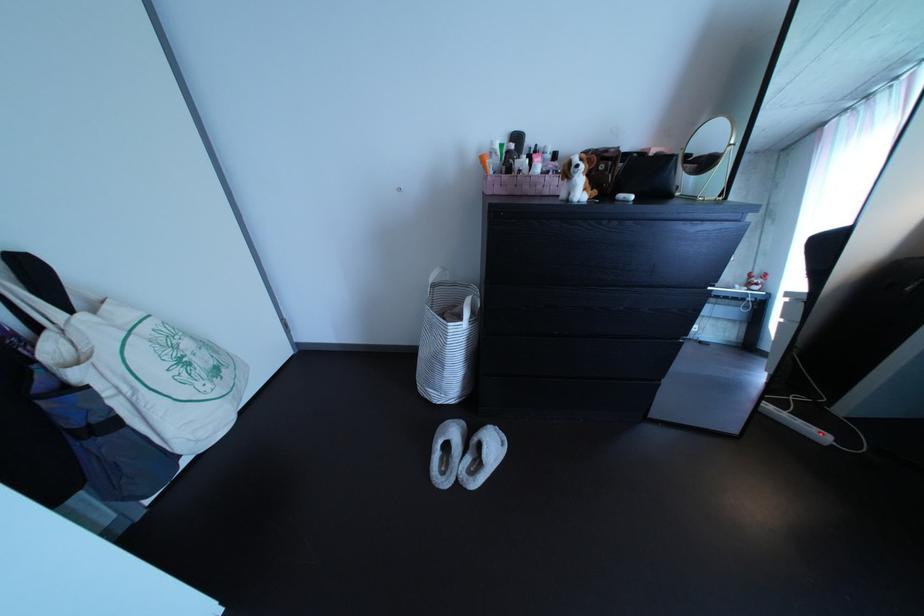
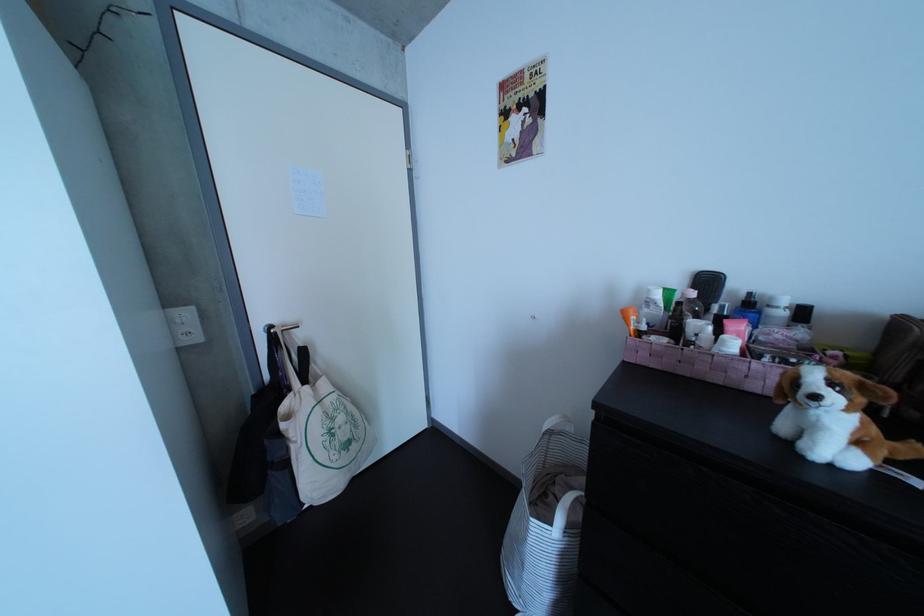
The point at (584, 171) is marked in the first image. Where is the corresponding point in the second image?

(809, 389)